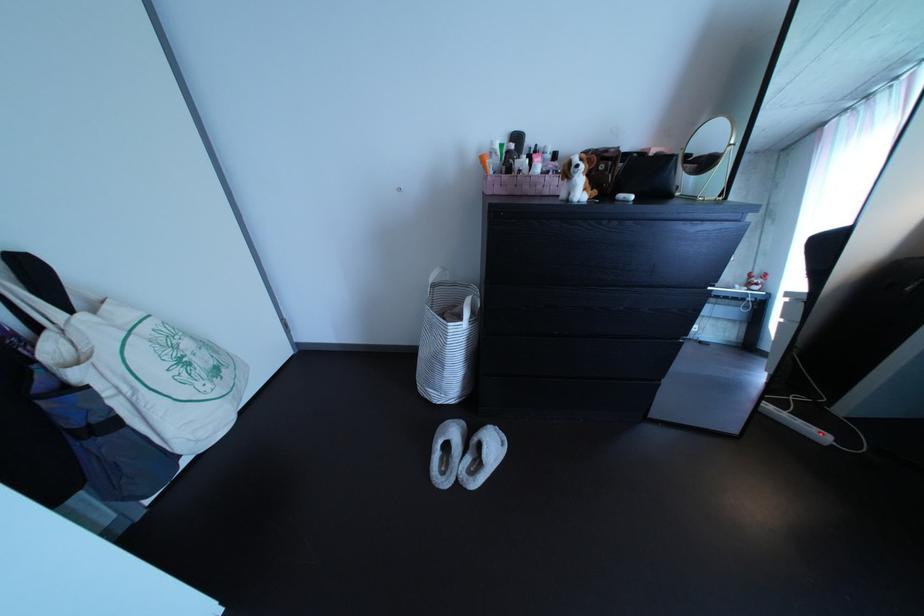
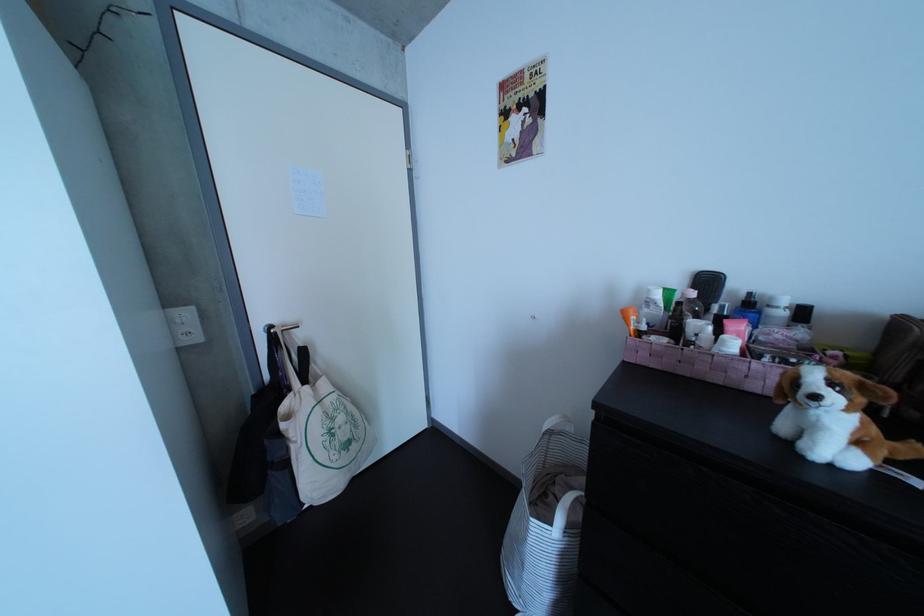
The point at (584, 171) is marked in the first image. Where is the corresponding point in the second image?

(809, 389)